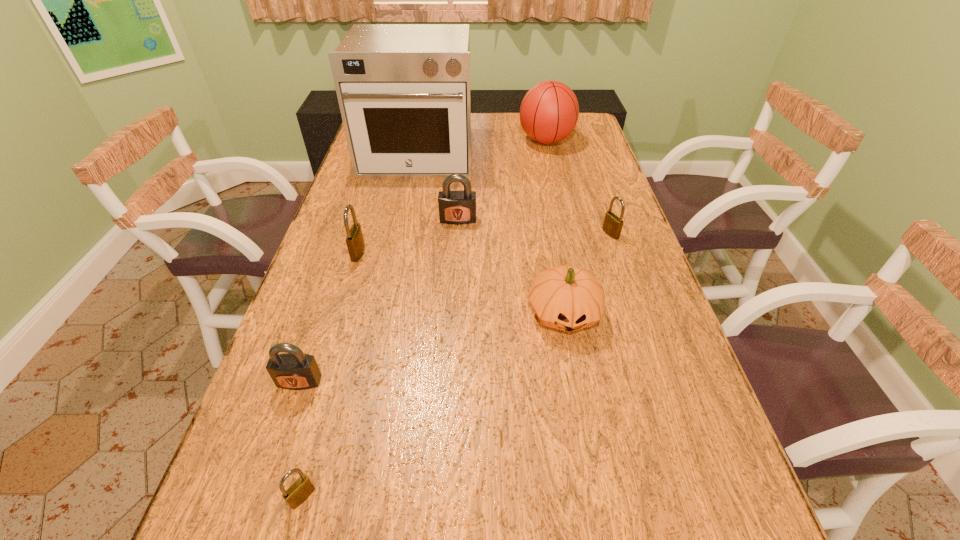
You are a GUI agent. You are given a task and a screenshot of the screen. Output one action in this format:
    pyautogui.click(x=<x>, y=<y>)
    Task: Click on the tallest object
    Image resolution: width=960 pixels, height=540 pixels.
    Given the screenshot: What is the action you would take?
    pyautogui.click(x=403, y=90)

Locate an element on the screen. The height and width of the screenshot is (540, 960). the seventh shortest object is located at coordinates (549, 111).

You are a GUI agent. You are given a task and a screenshot of the screen. Output one action in this format:
    pyautogui.click(x=<x>, y=<y>)
    Task: Click on the fifth farthest object
    This screenshot has height=540, width=960.
    Given the screenshot: What is the action you would take?
    pyautogui.click(x=355, y=243)

Find the location of a particular element. The image size is (960, 540). the second farthest brass padlock is located at coordinates (355, 243).

Where is `the right gray padlock`? the right gray padlock is located at coordinates [x=457, y=207].

Find the location of a particular element. The image size is (960, 540). the farthest padlock is located at coordinates (457, 207).

Where is `orange gourd`? orange gourd is located at coordinates (567, 298).

Where is `gourd`? This screenshot has height=540, width=960. gourd is located at coordinates (567, 298).

The image size is (960, 540). I want to click on the rightmost brass padlock, so click(612, 226).

Where is `the fourth nearest padlock`? the fourth nearest padlock is located at coordinates (612, 226).